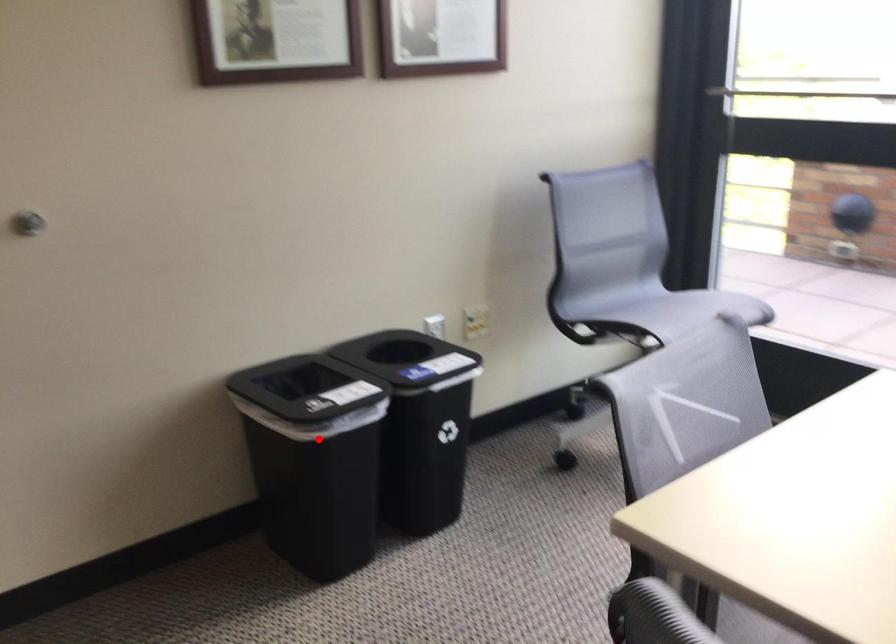
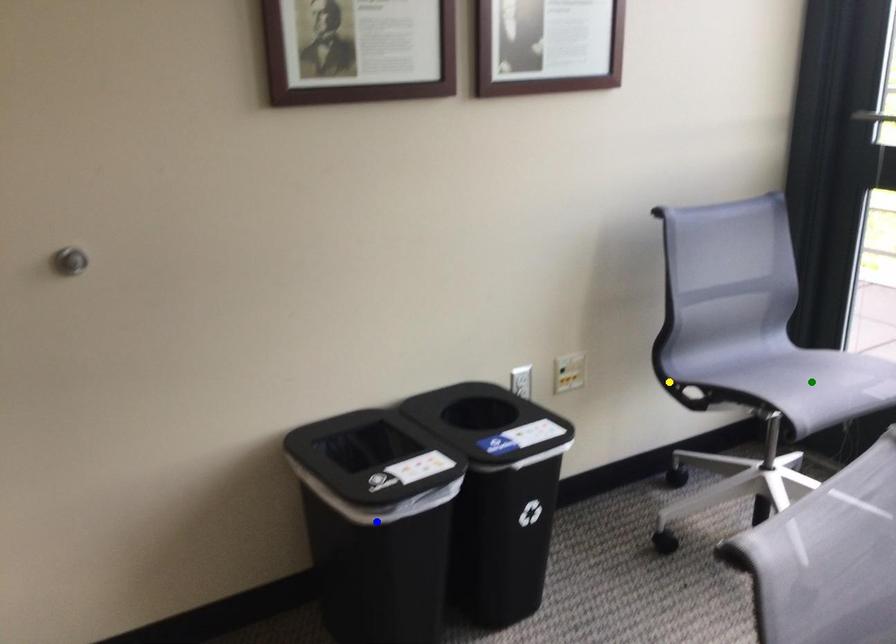
Question: I am providing you with two images of the same scene from different viewpoints. A red point is marked on the first image. You are given multiple points on the second image. Which point in image 2 represents the same 3d spot as the red point in image 1?

Choices:
 (A) blue point
 (B) green point
 (C) yellow point

Answer: (A)